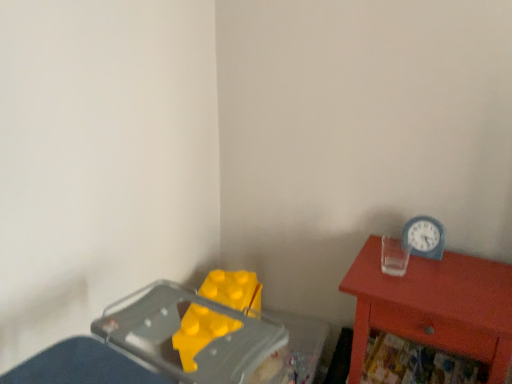
The height and width of the screenshot is (384, 512). Describe the element at coordinates (434, 306) in the screenshot. I see `matte red nightstand at right` at that location.

I want to click on matte red nightstand at right, so click(434, 306).

What are the coordinates of `blue plastic clock at upper right` in the screenshot? It's located at (424, 237).

This screenshot has height=384, width=512. Describe the element at coordinates (424, 237) in the screenshot. I see `blue plastic clock at upper right` at that location.

In order to face blue plastic clock at upper right, should I rotate leftwards or rightwards?

You should look right and rotate roughly 21.452 degrees.

The height and width of the screenshot is (384, 512). Find the location of `matte red nightstand at right`. matte red nightstand at right is located at coordinates (434, 306).

Between blue plastic clock at upper right and matte red nightstand at right, which one appears on the left side from the viewer's perspective?

From the viewer's perspective, blue plastic clock at upper right appears more on the left side.

Consider the image. Is blue plastic clock at upper right in front of or behind matte red nightstand at right in the image?

blue plastic clock at upper right is behind matte red nightstand at right.

Is point (444, 237) positioned behind point (398, 282)?

Yes.

Looking at this image, from the image's perspective, which one is positioned higher, blue plastic clock at upper right or matte red nightstand at right?

From the image's view, blue plastic clock at upper right is above.

From a real-world perspective, is blue plastic clock at upper right positioned over matte red nightstand at right based on gravity?

Correct, in the physical world, blue plastic clock at upper right is higher than matte red nightstand at right.

Which object is wider, blue plastic clock at upper right or matte red nightstand at right?

With larger width is matte red nightstand at right.

Between blue plastic clock at upper right and matte red nightstand at right, which one has more height?

With more height is matte red nightstand at right.

In terms of size, does blue plastic clock at upper right appear bigger or smaller than matte red nightstand at right?

blue plastic clock at upper right is smaller than matte red nightstand at right.

Is blue plastic clock at upper right not inside matte red nightstand at right?

Yes, blue plastic clock at upper right is located beyond the bounds of matte red nightstand at right.

Would you say blue plastic clock at upper right is a long distance from matte red nightstand at right?

No, there isn't a large distance between blue plastic clock at upper right and matte red nightstand at right.

Is blue plastic clock at upper right facing towards matte red nightstand at right?

No, blue plastic clock at upper right is not oriented towards matte red nightstand at right.

Find the location of a particular element. This screenshot has height=384, width=512. clock behind the matte red nightstand at right is located at coordinates (424, 237).

Would you say matte red nightstand at right is to the left or to the right of blue plastic clock at upper right in the picture?

From the image, it's evident that matte red nightstand at right is to the right of blue plastic clock at upper right.

In the scene shown: Is matte red nightstand at right behind blue plastic clock at upper right?

No, matte red nightstand at right is closer to the camera.

Which is less distant, (x=389, y=331) or (x=410, y=233)?

Point (x=389, y=331) is positioned closer to the camera compared to point (x=410, y=233).

From the image's perspective, who appears lower, matte red nightstand at right or blue plastic clock at upper right?

From the image's view, matte red nightstand at right is below.

From a real-world perspective, which object stands above the other?

blue plastic clock at upper right.

Does matte red nightstand at right have a lesser width compared to blue plastic clock at upper right?

No.

Between matte red nightstand at right and blue plastic clock at upper right, which one has less height?

blue plastic clock at upper right.

In the scene shown: Is matte red nightstand at right smaller than blue plastic clock at upper right?

Actually, matte red nightstand at right might be larger than blue plastic clock at upper right.

Which is correct: matte red nightstand at right is inside blue plastic clock at upper right, or outside of it?

matte red nightstand at right exists outside the volume of blue plastic clock at upper right.

Is matte red nightstand at right not near blue plastic clock at upper right?

Actually, matte red nightstand at right and blue plastic clock at upper right are a little close together.

Is matte red nightstand at right looking in the opposite direction of blue plastic clock at upper right?

matte red nightstand at right does not have its back to blue plastic clock at upper right.

The height and width of the screenshot is (384, 512). Identify the location of nightstand lying on the right of blue plastic clock at upper right. (434, 306).

The width and height of the screenshot is (512, 384). I want to click on clock above the matte red nightstand at right (from a real-world perspective), so click(x=424, y=237).

Where is `nightstand below the blue plastic clock at upper right (from a real-world perspective)`? The width and height of the screenshot is (512, 384). nightstand below the blue plastic clock at upper right (from a real-world perspective) is located at coordinates (434, 306).